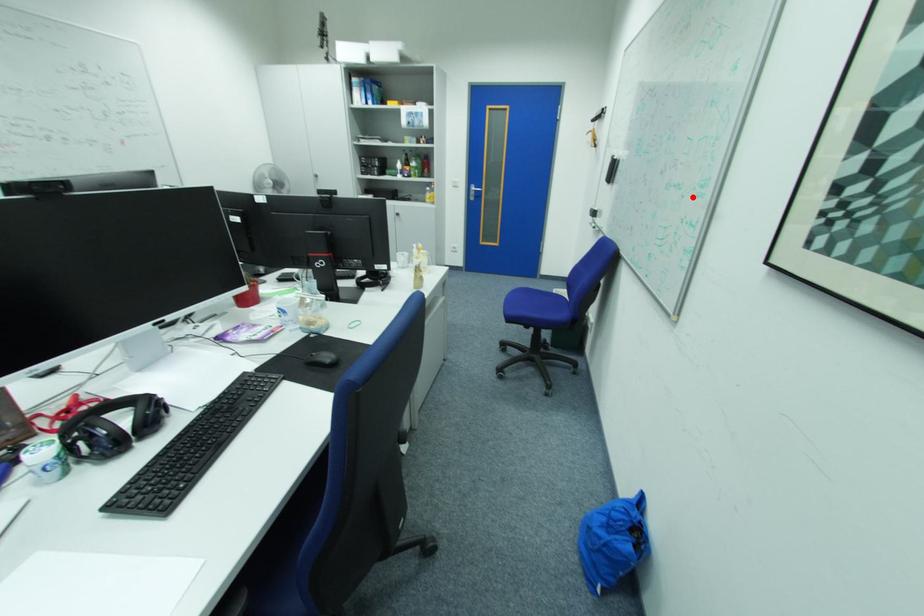
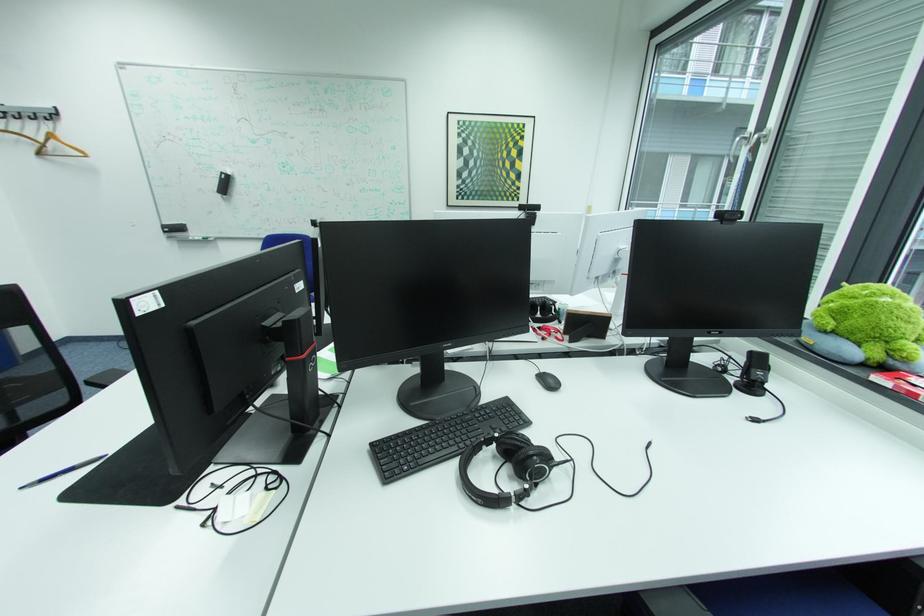
Find the pixel in the second image that matches the highlighted location in the first image.

(393, 195)